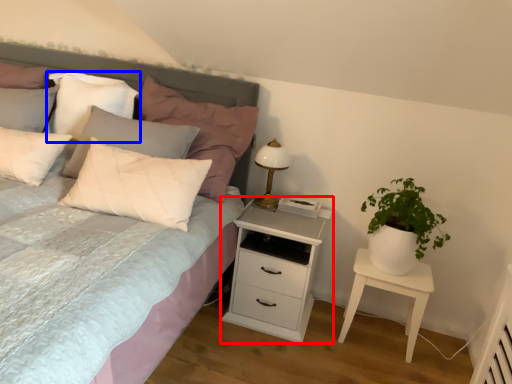
Question: Which of the following is the farthest to the observer, nightstand (highlighted by a red box) or pillow (highlighted by a blue box)?

Choices:
 (A) nightstand
 (B) pillow

Answer: (B)